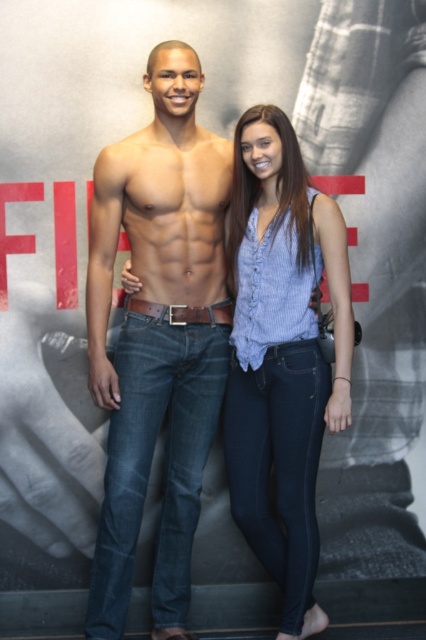
Question: Which of the following is the closest to the observer?

Choices:
 (A) matte black torso at center
 (B) blue denim jeans at center

Answer: (A)

Question: Which point appears closest to the camera in this image?

Choices:
 (A) (284, 150)
 (B) (143, 336)

Answer: (A)

Question: Is matte black torso at center bigger than blue denim jeans at center?

Choices:
 (A) yes
 (B) no

Answer: (A)

Question: Which object appears farthest from the camera in this image?

Choices:
 (A) blue denim jeans at center
 (B) matte black torso at center

Answer: (A)

Question: Observing the image, what is the correct spatial positioning of matte black torso at center in reference to blue denim jeans at center?

Choices:
 (A) right
 (B) left

Answer: (B)

Question: Does matte black torso at center have a lesser width compared to blue denim jeans at center?

Choices:
 (A) no
 (B) yes

Answer: (A)